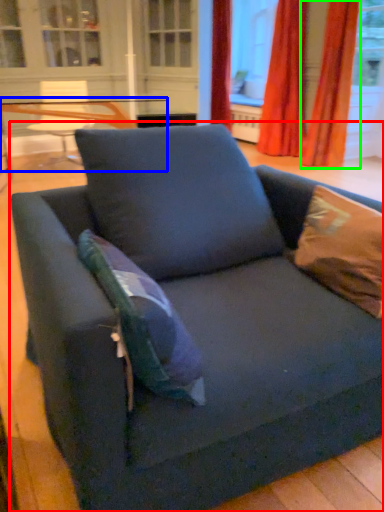
Question: Which object is the farthest from studio couch (highlighted by a red box)? Choose among these: table (highlighted by a blue box) or curtain (highlighted by a green box).

Choices:
 (A) table
 (B) curtain

Answer: (B)